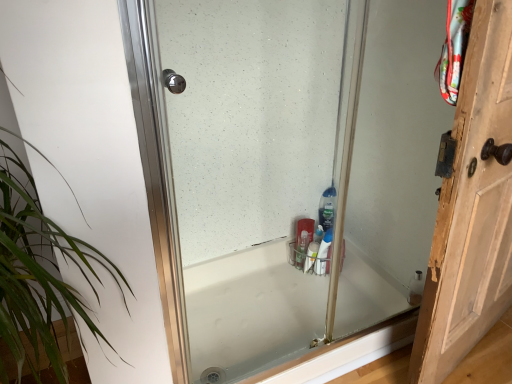
At what (x,y) coordinates should I click in order to perform the action: click on free space below clear glass shower door at center (from a real-world perspective). Please return your answer as a coordinate pair (x, y). Looking at the image, I should click on (337, 354).